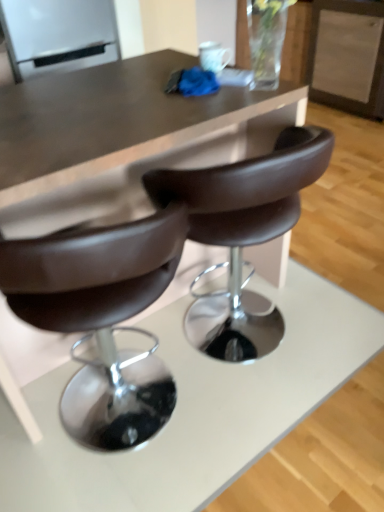
Question: Is brown leather chair at center bigger or smaller than matte brown table at center?

Choices:
 (A) big
 (B) small

Answer: (B)

Question: Is brown leather chair at center to the left or to the right of matte brown table at center in the image?

Choices:
 (A) right
 (B) left

Answer: (A)

Question: Estimate the real-world distances between objects in this image. Which object is farther from the brown leather chair at center?

Choices:
 (A) matte brown table at center
 (B) white glossy refrigerator at upper left

Answer: (B)

Question: Estimate the real-world distances between objects in this image. Which object is closer to the brown leather chair at center?

Choices:
 (A) matte brown table at center
 (B) white glossy refrigerator at upper left

Answer: (A)